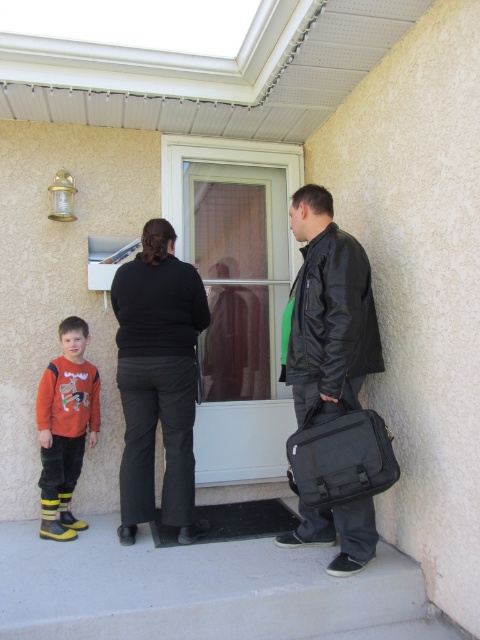
Question: Can you confirm if black matte pants at center is thinner than orange cotton sweater at left?

Choices:
 (A) no
 (B) yes

Answer: (A)

Question: Which object is positioned closest to the orange cotton sweater at left?

Choices:
 (A) black leather jacket at right
 (B) black fabric bag at lower right
 (C) black matte pants at center

Answer: (C)

Question: Is black leather jacket at right to the right of black fabric bag at lower right from the viewer's perspective?

Choices:
 (A) yes
 (B) no

Answer: (B)

Question: Which object is positioned closest to the black fabric bag at lower right?

Choices:
 (A) black leather jacket at right
 (B) black matte pants at center

Answer: (A)

Question: Which object is the closest to the black matte pants at center?

Choices:
 (A) black fabric bag at lower right
 (B) orange cotton sweater at left

Answer: (B)

Question: Does black matte pants at center have a smaller size compared to black leather jacket at right?

Choices:
 (A) no
 (B) yes

Answer: (B)